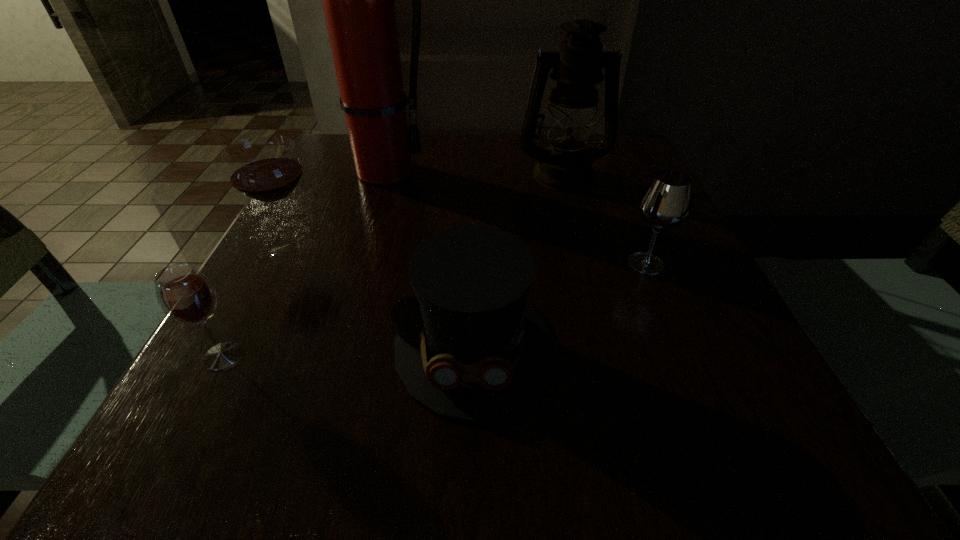
Where is `the tallest object`? the tallest object is located at coordinates (358, 0).

Locate an element on the screen. The width and height of the screenshot is (960, 540). the fifth shortest object is located at coordinates coord(577,66).

Locate an element on the screen. the rightmost wineglass is located at coordinates (666, 202).

This screenshot has width=960, height=540. In order to click on the nearest wineglass in this screenshot , I will do tap(185, 295).

Find the location of a particular element. The image size is (960, 540). dress hat is located at coordinates (472, 348).

Identify the location of vacant region located on the hose direction of the tallest object. This screenshot has height=540, width=960. (601, 172).

Where is `vacant space located 0.340m on the left of the fifth shortest object`? vacant space located 0.340m on the left of the fifth shortest object is located at coordinates (371, 174).

Identify the location of vacant space situated on the left of the rightmost wineglass. (421, 264).

Image resolution: width=960 pixels, height=540 pixels. Find the location of `free space located 0.130m on the right of the nearest wineglass`. free space located 0.130m on the right of the nearest wineglass is located at coordinates coord(335,356).

What are the coordinates of `vacant space located 0.050m with goggles on the front of the dress hat` in the screenshot? It's located at (471, 462).